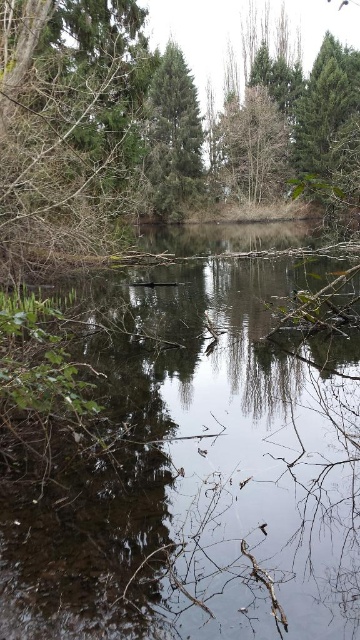
Can you confirm if transparent water at center is smaller than green matte tree at center?

Yes, transparent water at center is smaller than green matte tree at center.

Consider the image. Who is more distant from viewer, (87, 541) or (186, 76)?

The point (186, 76) is behind.

Between point (312, 550) and point (177, 56), which one is positioned in front?

Point (312, 550) is in front.

I want to click on transparent water at center, so click(x=200, y=472).

How much distance is there between green matte tree at upper left and green matte tree at center?

The distance of green matte tree at upper left from green matte tree at center is 16.63 meters.

Looking at this image, which is below, green matte tree at upper left or green matte tree at center?

Positioned lower is green matte tree at upper left.

Measure the distance between green matte tree at upper left and camera.

green matte tree at upper left and camera are 9.13 meters apart.

This screenshot has height=640, width=360. In order to click on green matte tree at upper left in this screenshot , I will do `click(66, 120)`.

Is transparent water at center above green matte tree at upper left?

Actually, transparent water at center is below green matte tree at upper left.

Is point (267, 349) closer to camera compared to point (111, 54)?

That is True.

Identify the location of transparent water at center. This screenshot has height=640, width=360. click(x=200, y=472).